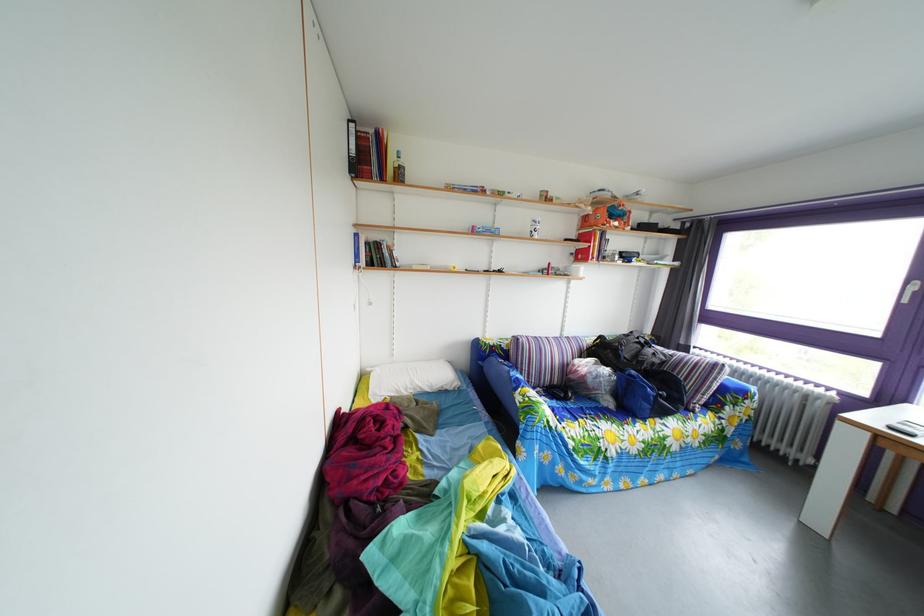
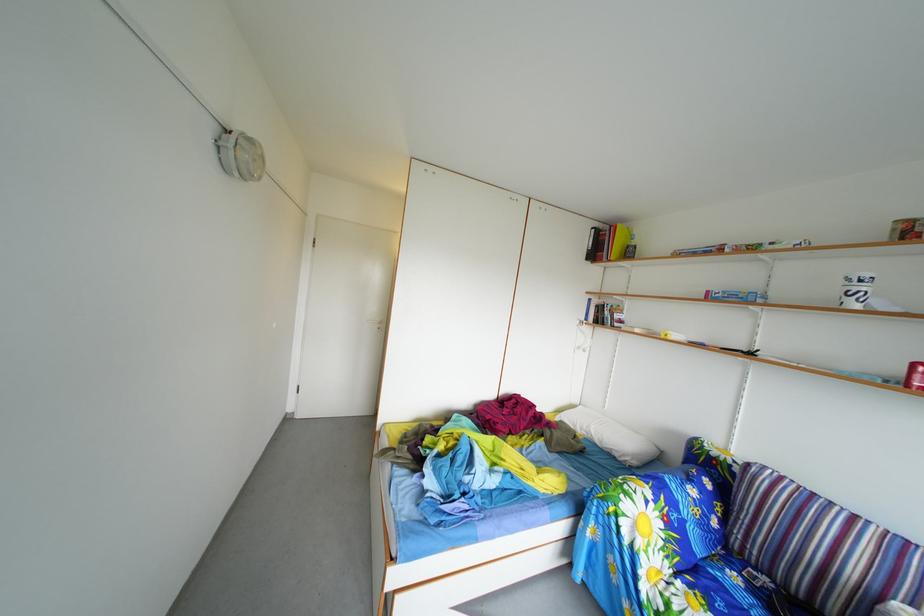
Where in the second image is the point corresponding to pixel 545 230 from the first image?

(859, 288)